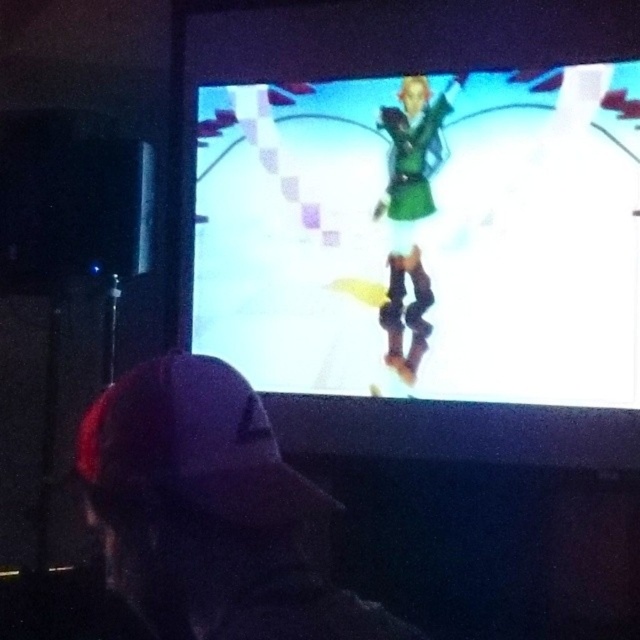
You are a game developer analyzing the scene. You need to determine the spatial relationship between the dark fabric cap at lower left and the green matte dress at center. Based on the scene, which object is located below the other?

The dark fabric cap at lower left is positioned under the green matte dress at center, meaning it is located below the green matte dress at center.

You are a game developer analyzing the scene. You notice the dark fabric cap at lower left and the green matte dress at center. Which object is closer to the viewer?

The dark fabric cap at lower left is closer to the viewer because it is in front of the green matte dress at center.

You are a game developer standing 30 inches away from the screen. You need to check if the dark fabric cap at lower left is within your viewing range. Is it closer than your current distance?

The dark fabric cap at lower left is 27.13 inches away from the viewer, which is closer than your current 30 inches distance. Therefore, it is within your viewing range.